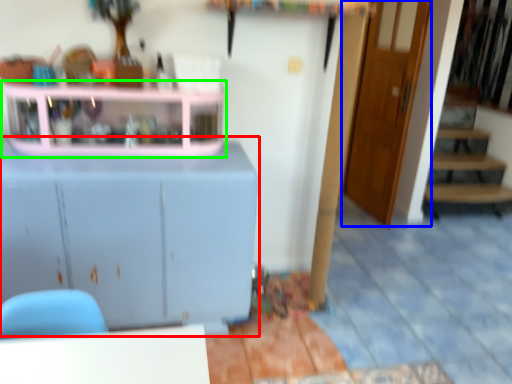
Question: Which object is positioned farthest from cabinetry (highlighted by a red box)? Select from door (highlighted by a blue box) and shelf (highlighted by a green box).

Choices:
 (A) door
 (B) shelf

Answer: (A)